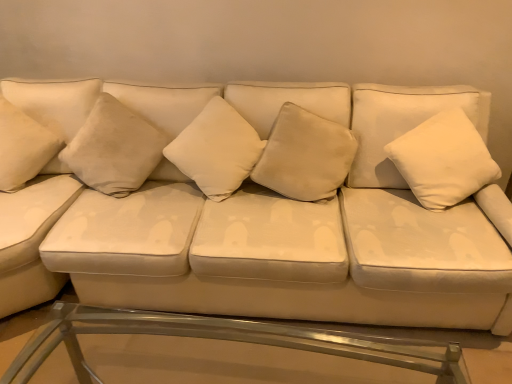
Question: Does point (487, 163) appear closer or farther from the camera than point (151, 145)?

Choices:
 (A) closer
 (B) farther

Answer: (A)

Question: Is white velvety pillow at right, which appears as the 5th pillow when viewed from the left, situated inside suede-like beige pillow at center, which appears as the 2th pillow when viewed from the left, or outside?

Choices:
 (A) inside
 (B) outside

Answer: (B)

Question: Which of these objects is positioned farthest from the white velvety pillow at right, which appears as the 5th pillow when viewed from the left?

Choices:
 (A) suede white couch at center
 (B) clear glass table at lower center
 (C) white soft cushion at center, the third pillow viewed from the right
 (D) suede-like beige pillow at center, the fourth pillow from the right
 (E) suede-like beige pillow at center, the 4th pillow positioned from the left

Answer: (D)

Question: Which object is positioned closest to the suede-like beige pillow at center, the second pillow from the right?

Choices:
 (A) white soft cushion at center, the third pillow viewed from the right
 (B) suede white couch at center
 (C) clear glass table at lower center
 (D) white velvety pillow at left, the fifth pillow positioned from the right
 (E) suede-like beige pillow at center, the fourth pillow from the right

Answer: (A)